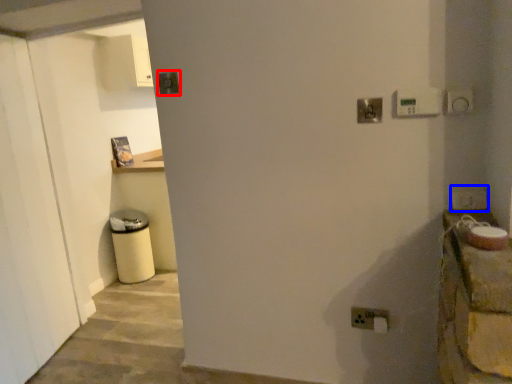
Question: Which of the following is the farthest to the observer, light switch (highlighted by a red box) or light switch (highlighted by a blue box)?

Choices:
 (A) light switch
 (B) light switch

Answer: (A)